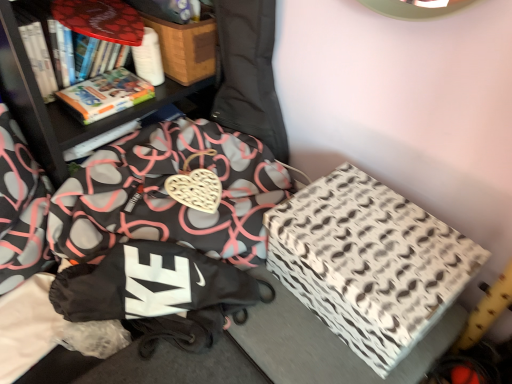
Describe the element at coordinates (368, 263) in the screenshot. I see `white-patterned cardboard box at right, acting as the 1th cardboard box starting from the bottom` at that location.

Consider the image. What is the approximate height of black fabric bag at lower left?

13.85 inches.

What do you see at coordinates (21, 208) in the screenshot?
I see `black fabric bag at lower left` at bounding box center [21, 208].

Identify the location of white-patterned cardboard box at right, the second cardboard box viewed from the left. The width and height of the screenshot is (512, 384). (368, 263).

Does white-patterned cardboard box at right, the second cardboard box viewed from the left, contain black fabric bag at lower left?

Actually, black fabric bag at lower left is outside white-patterned cardboard box at right, the second cardboard box viewed from the left.

Is white-patterned cardboard box at right, positioned as the 2th cardboard box in top-to-bottom order, wider than black fabric bag at lower left?

No.

Looking at this image, from the image's perspective, which one is positioned higher, white-patterned cardboard box at right, positioned as the 2th cardboard box in top-to-bottom order, or black fabric bag at lower left?

black fabric bag at lower left appears higher in the image.

How different are the orientations of white-patterned cardboard box at right, the 1th cardboard box viewed from the right, and black fabric bag at lower left in degrees?

They differ by 95 degrees in their facing directions.

From the image's perspective, is black fabric bean bag chair at center above or below white-patterned cardboard box at right, acting as the 1th cardboard box starting from the bottom?

From the image's perspective, black fabric bean bag chair at center appears above white-patterned cardboard box at right, acting as the 1th cardboard box starting from the bottom.

From the picture: Which is more to the left, black fabric bean bag chair at center or white-patterned cardboard box at right, the 1th cardboard box viewed from the right?

black fabric bean bag chair at center is more to the left.

Who is smaller, black fabric bean bag chair at center or white-patterned cardboard box at right, acting as the 1th cardboard box starting from the bottom?

black fabric bean bag chair at center is smaller.

Consider the image. Is black fabric bean bag chair at center surrounding white-patterned cardboard box at right, the second cardboard box viewed from the left?

Actually, white-patterned cardboard box at right, the second cardboard box viewed from the left, is outside black fabric bean bag chair at center.

From the image's perspective, is hardcover book at upper left located above or below black fabric bean bag chair at center?

hardcover book at upper left is below black fabric bean bag chair at center.

Which object is further away from the camera taking this photo, hardcover book at upper left or black fabric bean bag chair at center?

hardcover book at upper left is behind.

Considering the positions of points (148, 88) and (259, 46), is point (148, 88) closer to camera compared to point (259, 46)?

No, (148, 88) is behind (259, 46).

Is black fabric bag at lower left not near black fabric bean bag chair at center?

No.

Which of these two, black fabric bag at lower left or black fabric bean bag chair at center, stands shorter?

Standing shorter between the two is black fabric bag at lower left.

Would you say black fabric bag at lower left is to the left or to the right of black fabric bean bag chair at center in the picture?

From the image, it's evident that black fabric bag at lower left is to the left of black fabric bean bag chair at center.

Locate an element on the screen. The image size is (512, 384). bean bag chair behind the black fabric bag at lower left is located at coordinates (249, 73).

Is white-patterned cardboard box at right, the 1th cardboard box viewed from the right, directly adjacent to hardcover book at upper left?

No, white-patterned cardboard box at right, the 1th cardboard box viewed from the right, is not in contact with hardcover book at upper left.

How different are the orientations of white-patterned cardboard box at right, positioned as the 2th cardboard box in top-to-bottom order, and hardcover book at upper left in degrees?

The angle between the facing direction of white-patterned cardboard box at right, positioned as the 2th cardboard box in top-to-bottom order, and the facing direction of hardcover book at upper left is 96.8 degrees.

Does white-patterned cardboard box at right, positioned as the 2th cardboard box in top-to-bottom order, have a greater height compared to hardcover book at upper left?

Indeed, white-patterned cardboard box at right, positioned as the 2th cardboard box in top-to-bottom order, has a greater height compared to hardcover book at upper left.

Measure the distance from white-patterned cardboard box at right, positioned as the 2th cardboard box in top-to-bottom order, to hardcover book at upper left.

The distance of white-patterned cardboard box at right, positioned as the 2th cardboard box in top-to-bottom order, from hardcover book at upper left is 24.29 inches.

In order to click on cardboard box below the wooden box at upper center, positioned as the 2th cardboard box in bottom-to-top order (from the image's perspective) in this screenshot , I will do `click(368, 263)`.

Is the position of white-patterned cardboard box at right, positioned as the 2th cardboard box in top-to-bottom order, more distant than that of wooden box at upper center, the second cardboard box in the right-to-left sequence?

No, white-patterned cardboard box at right, positioned as the 2th cardboard box in top-to-bottom order, is closer to the viewer.

Can you confirm if white-patterned cardboard box at right, acting as the 1th cardboard box starting from the bottom, is bigger than wooden box at upper center, the second cardboard box in the right-to-left sequence?

Yes, white-patterned cardboard box at right, acting as the 1th cardboard box starting from the bottom, is bigger than wooden box at upper center, the second cardboard box in the right-to-left sequence.

Which object is wider, hardcover book at upper left or wooden box at upper center, the second cardboard box in the right-to-left sequence?

Wider between the two is wooden box at upper center, the second cardboard box in the right-to-left sequence.

Considering the sizes of objects hardcover book at upper left and wooden box at upper center, the first cardboard box when ordered from top to bottom, in the image provided, who is smaller, hardcover book at upper left or wooden box at upper center, the first cardboard box when ordered from top to bottom,?

hardcover book at upper left.

From the image's perspective, which is above, hardcover book at upper left or wooden box at upper center, which appears as the 1th cardboard box when viewed from the left?

wooden box at upper center, which appears as the 1th cardboard box when viewed from the left, appears higher in the image.

The image size is (512, 384). Find the location of `cardboard box in front of the black fabric bag at lower left`. cardboard box in front of the black fabric bag at lower left is located at coordinates (368, 263).

From a real-world perspective, which cardboard box is the 2nd one underneath the black fabric bean bag chair at center? Please provide its 2D coordinates.

[(368, 263)]

Considering their positions, is wooden box at upper center, positioned as the 2th cardboard box in bottom-to-top order, positioned closer to hardcover book at upper left than black fabric bean bag chair at center?

wooden box at upper center, positioned as the 2th cardboard box in bottom-to-top order, lies closer to hardcover book at upper left than the other object.

Which object lies further to the anchor point wooden box at upper center, which appears as the 1th cardboard box when viewed from the left, white-patterned cardboard box at right, positioned as the 2th cardboard box in top-to-bottom order, or black fabric bean bag chair at center?

white-patterned cardboard box at right, positioned as the 2th cardboard box in top-to-bottom order, is positioned further to the anchor wooden box at upper center, which appears as the 1th cardboard box when viewed from the left.

Considering their positions, is hardcover book at upper left positioned further to wooden box at upper center, the second cardboard box in the right-to-left sequence, than white-patterned cardboard box at right, positioned as the 2th cardboard box in top-to-bottom order?

white-patterned cardboard box at right, positioned as the 2th cardboard box in top-to-bottom order, lies further to wooden box at upper center, the second cardboard box in the right-to-left sequence, than the other object.

From the image, which object appears to be farther from hardcover book at upper left, black fabric bean bag chair at center or wooden box at upper center, the second cardboard box in the right-to-left sequence?

black fabric bean bag chair at center.

Based on their spatial positions, is white-patterned cardboard box at right, the second cardboard box viewed from the left, or black fabric bag at lower left closer to black fabric bean bag chair at center?

white-patterned cardboard box at right, the second cardboard box viewed from the left, lies closer to black fabric bean bag chair at center than the other object.

Which object lies further to the anchor point wooden box at upper center, the second cardboard box in the right-to-left sequence, black fabric bean bag chair at center or black fabric bag at lower left?

black fabric bag at lower left is positioned further to the anchor wooden box at upper center, the second cardboard box in the right-to-left sequence.

Based on their spatial positions, is hardcover book at upper left or black fabric bean bag chair at center closer to wooden box at upper center, the second cardboard box in the right-to-left sequence?

black fabric bean bag chair at center is positioned closer to the anchor wooden box at upper center, the second cardboard box in the right-to-left sequence.

From the image, which object appears to be farther from black fabric bag at lower left, wooden box at upper center, the first cardboard box when ordered from top to bottom, or white-patterned cardboard box at right, the 1th cardboard box viewed from the right?

white-patterned cardboard box at right, the 1th cardboard box viewed from the right, is positioned further to the anchor black fabric bag at lower left.

Where is `cardboard box located between black fabric bag at lower left and white-patterned cardboard box at right, the second cardboard box viewed from the left, in the left-right direction`? This screenshot has height=384, width=512. cardboard box located between black fabric bag at lower left and white-patterned cardboard box at right, the second cardboard box viewed from the left, in the left-right direction is located at coordinates (186, 48).

Find the location of a particular element. The width and height of the screenshot is (512, 384). cardboard box between hardcover book at upper left and white-patterned cardboard box at right, acting as the 1th cardboard box starting from the bottom, in the horizontal direction is located at coordinates (186, 48).

Identify the location of bean bag chair between hardcover book at upper left and white-patterned cardboard box at right, the 1th cardboard box viewed from the right, from left to right. This screenshot has width=512, height=384. click(249, 73).

I want to click on cardboard box located between black fabric bag at lower left and black fabric bean bag chair at center in the left-right direction, so click(186, 48).